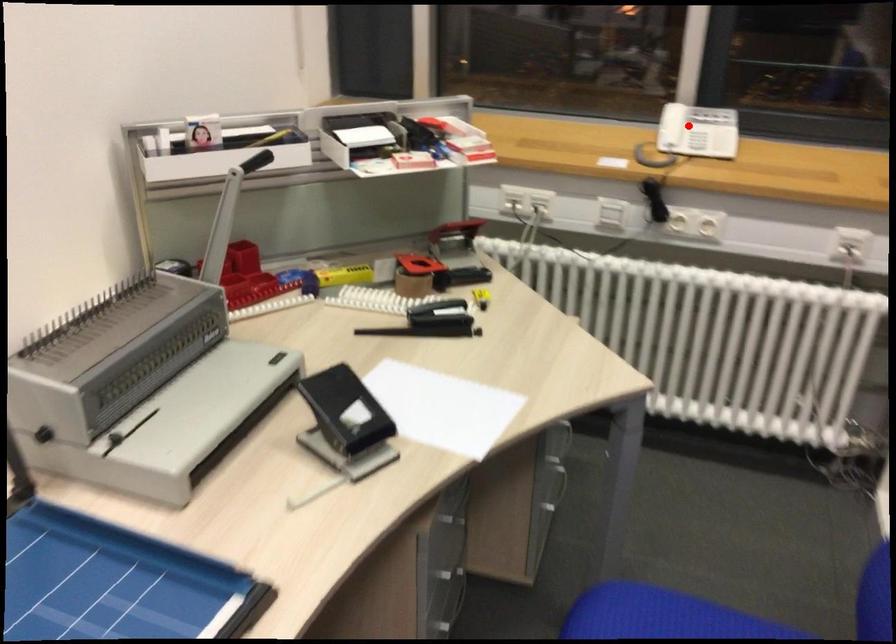
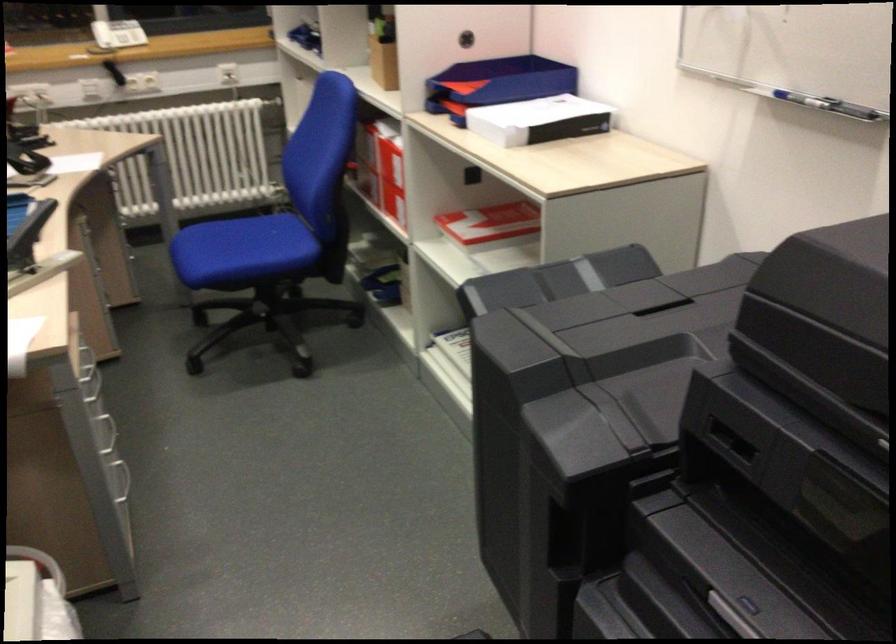
Find the pixel in the second image that matches the highlighted location in the first image.

(117, 33)